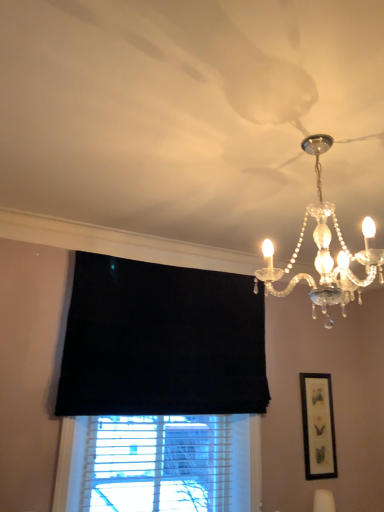
Question: Relative to clear crystal chandelier at upper right, is matte black picture frame at right in front or behind?

Choices:
 (A) front
 (B) behind

Answer: (B)

Question: Considering the positions of matte black picture frame at right and clear crystal chandelier at upper right in the image, is matte black picture frame at right taller or shorter than clear crystal chandelier at upper right?

Choices:
 (A) short
 (B) tall

Answer: (B)

Question: Considering the positions of matte black picture frame at right and clear crystal chandelier at upper right in the image, is matte black picture frame at right bigger or smaller than clear crystal chandelier at upper right?

Choices:
 (A) small
 (B) big

Answer: (A)

Question: Do you think clear crystal chandelier at upper right is within matte black picture frame at right, or outside of it?

Choices:
 (A) inside
 (B) outside

Answer: (B)

Question: In terms of width, does clear crystal chandelier at upper right look wider or thinner when compared to matte black picture frame at right?

Choices:
 (A) thin
 (B) wide

Answer: (B)

Question: From the image's perspective, is clear crystal chandelier at upper right located above or below matte black picture frame at right?

Choices:
 (A) above
 (B) below

Answer: (A)

Question: Is point (317, 146) closer or farther from the camera than point (319, 443)?

Choices:
 (A) closer
 (B) farther

Answer: (A)